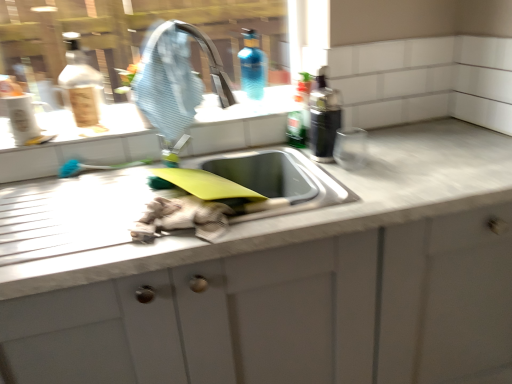
Question: Is blue glass bottle at upper center, arranged as the third bottle when viewed from the right, far away from transparent glass window at upper center?

Choices:
 (A) yes
 (B) no

Answer: (B)

Question: Is blue glass bottle at upper center, arranged as the third bottle when viewed from the right, to the right of transparent glass window at upper center from the viewer's perspective?

Choices:
 (A) yes
 (B) no

Answer: (A)

Question: Is blue glass bottle at upper center, which is the first bottle in left-to-right order, at the left side of transparent glass window at upper center?

Choices:
 (A) yes
 (B) no

Answer: (B)

Question: Is blue glass bottle at upper center, which is the first bottle in left-to-right order, facing away from transparent glass window at upper center?

Choices:
 (A) yes
 (B) no

Answer: (A)

Question: From the image's perspective, does blue glass bottle at upper center, which is the first bottle in left-to-right order, appear higher than transparent glass window at upper center?

Choices:
 (A) no
 (B) yes

Answer: (A)

Question: From a real-world perspective, is black plastic bottle at upper right, which appears as the first bottle when viewed from the right, positioned above or below transparent glass window at upper center?

Choices:
 (A) above
 (B) below

Answer: (B)

Question: Is point (326, 135) closer or farther from the camera than point (82, 21)?

Choices:
 (A) closer
 (B) farther

Answer: (A)

Question: In terms of width, does black plastic bottle at upper right, which appears as the first bottle when viewed from the right, look wider or thinner when compared to transparent glass window at upper center?

Choices:
 (A) wide
 (B) thin

Answer: (A)

Question: From their relative heights in the image, would you say black plastic bottle at upper right, which appears as the first bottle when viewed from the right, is taller or shorter than transparent glass window at upper center?

Choices:
 (A) tall
 (B) short

Answer: (B)

Question: From a real-world perspective, is black plastic bottle at upper right, marked as the 3th bottle in a left-to-right arrangement, physically located above or below blue glass bottle at upper center, arranged as the third bottle when viewed from the right?

Choices:
 (A) above
 (B) below

Answer: (B)

Question: From the image's perspective, is black plastic bottle at upper right, which appears as the first bottle when viewed from the right, positioned above or below blue glass bottle at upper center, which is the first bottle in left-to-right order?

Choices:
 (A) above
 (B) below

Answer: (B)

Question: Considering the positions of black plastic bottle at upper right, marked as the 3th bottle in a left-to-right arrangement, and blue glass bottle at upper center, which is the first bottle in left-to-right order, in the image, is black plastic bottle at upper right, marked as the 3th bottle in a left-to-right arrangement, taller or shorter than blue glass bottle at upper center, which is the first bottle in left-to-right order,?

Choices:
 (A) tall
 (B) short

Answer: (B)

Question: In terms of width, does black plastic bottle at upper right, marked as the 3th bottle in a left-to-right arrangement, look wider or thinner when compared to blue glass bottle at upper center, arranged as the third bottle when viewed from the right?

Choices:
 (A) thin
 (B) wide

Answer: (A)

Question: From a real-world perspective, is white marble countertop at center positioned above or below white glossy sink at upper center?

Choices:
 (A) above
 (B) below

Answer: (B)

Question: Based on their sizes in the image, would you say white marble countertop at center is bigger or smaller than white glossy sink at upper center?

Choices:
 (A) big
 (B) small

Answer: (A)